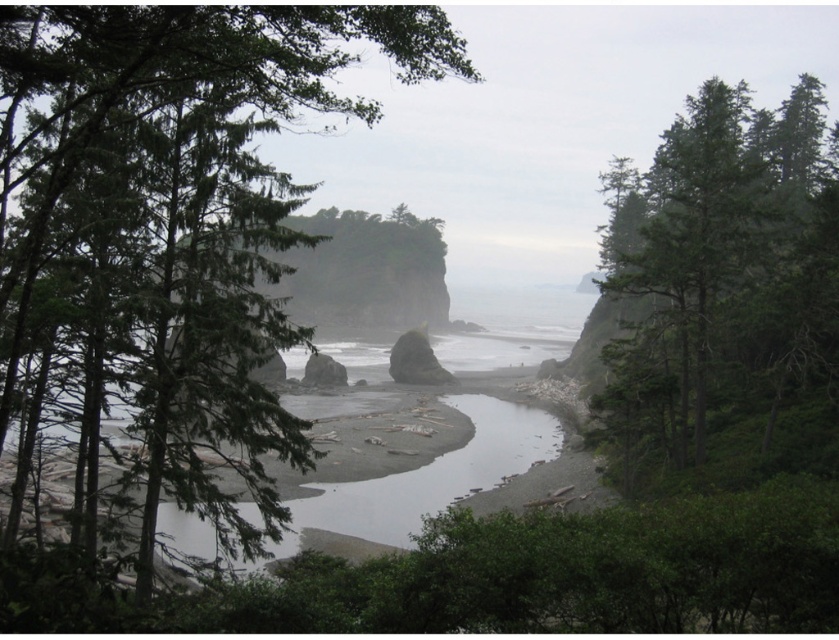
Question: Which point appears farthest from the camera in this image?

Choices:
 (A) coord(165,76)
 (B) coord(831,129)

Answer: (B)

Question: In this image, where is green leafy tree at center located relative to green textured tree at upper right?

Choices:
 (A) below
 (B) above

Answer: (B)

Question: Does green leafy tree at center come behind green textured tree at upper right?

Choices:
 (A) no
 (B) yes

Answer: (A)

Question: Which point appears closest to the camera in this image?

Choices:
 (A) (185, 125)
 (B) (785, 218)

Answer: (A)

Question: Among these points, which one is nearest to the camera?

Choices:
 (A) (238, 195)
 (B) (811, 154)

Answer: (A)

Question: Is green leafy tree at center thinner than green textured tree at upper right?

Choices:
 (A) no
 (B) yes

Answer: (A)